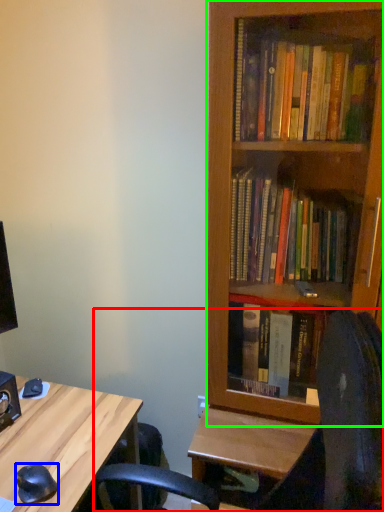
Question: Estimate the real-world distances between objects in this image. Which object is farther from computer chair (highlighted by a red box), mouse (highlighted by a blue box) or bookcase (highlighted by a green box)?

Choices:
 (A) mouse
 (B) bookcase

Answer: (A)